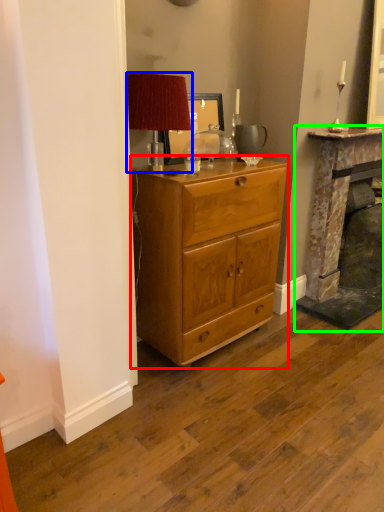
Question: Considering the real-world distances, which object is closest to chest of drawers (highlighted by a red box)? table lamp (highlighted by a blue box) or fireplace (highlighted by a green box).

Choices:
 (A) table lamp
 (B) fireplace

Answer: (A)